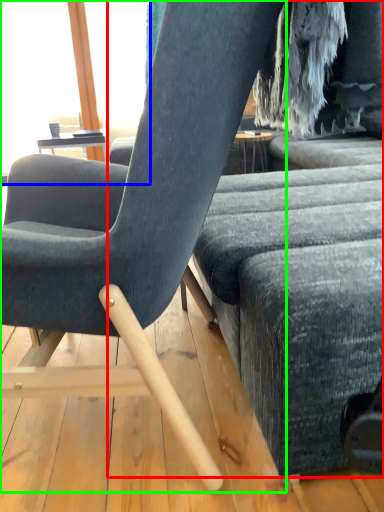
Question: Estimate the real-world distances between objects in this image. Which object is closer to studio couch (highlighted by a red box), window screen (highlighted by a blue box) or chair (highlighted by a green box)?

Choices:
 (A) window screen
 (B) chair

Answer: (B)